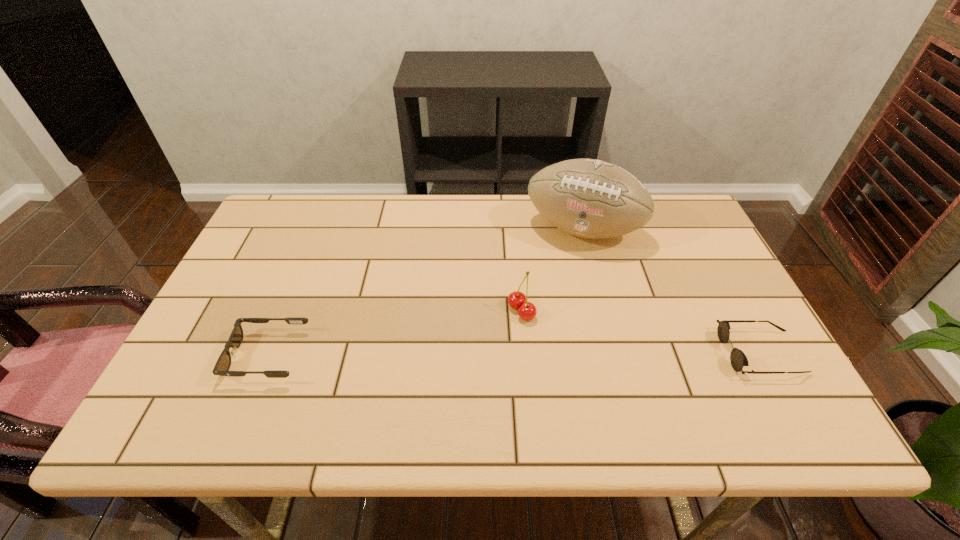
Identify the location of free space on the desktop that is between the leftmost object and the rightmost object and is positioned on the laces of the farthest object. This screenshot has height=540, width=960. (548, 354).

You are a GUI agent. You are given a task and a screenshot of the screen. Output one action in this format:
    pyautogui.click(x=<x>, y=<y>)
    Task: Click on the free space on the desktop that is between the left sunglasses and the right sunglasses and is positioned with the stems of the second farthest object pointing upwards
    
    Given the screenshot: What is the action you would take?
    (443, 355)